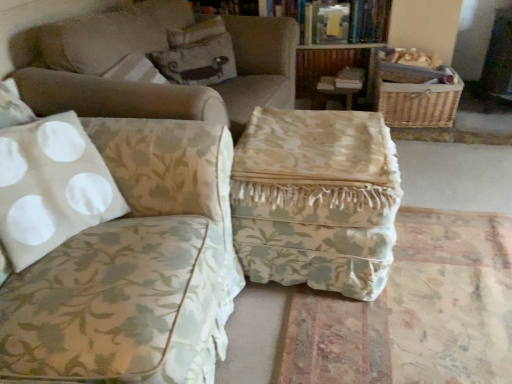
At what (x,y) coordinates should I click in order to perform the action: click on empty space that is in between floral fabric ottoman at center and floral fabric ottoman at center. Please return your answer as a coordinate pair (x, y). Image resolution: width=512 pixels, height=384 pixels. Looking at the image, I should click on (255, 326).